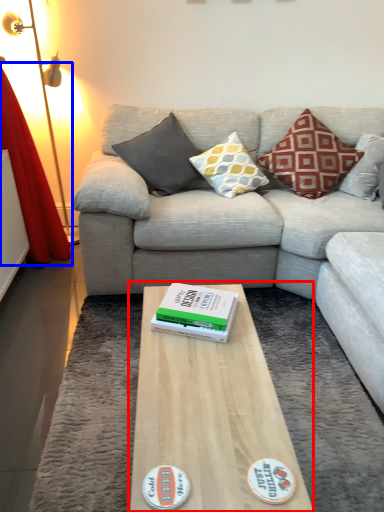
Question: Which object appears farthest to the camera in this image, coffee table (highlighted by a red box) or curtain (highlighted by a blue box)?

Choices:
 (A) coffee table
 (B) curtain

Answer: (B)